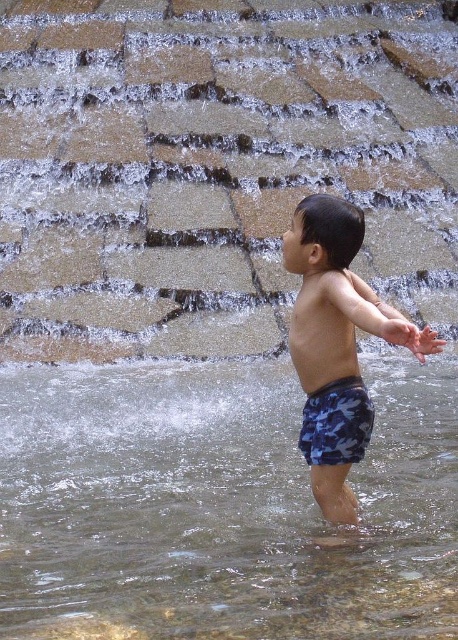
Is clear water at lower center thinner than blue camouflage shorts at center?

No, clear water at lower center is not thinner than blue camouflage shorts at center.

Based on the photo, does clear water at lower center appear under blue camouflage shorts at center?

Yes, clear water at lower center is below blue camouflage shorts at center.

What do you see at coordinates (221, 504) in the screenshot? I see `clear water at lower center` at bounding box center [221, 504].

You are a GUI agent. You are given a task and a screenshot of the screen. Output one action in this format:
    pyautogui.click(x=<x>, y=<y>)
    Task: Click on the clear water at lower center
    The width and height of the screenshot is (458, 640).
    Given the screenshot: What is the action you would take?
    pyautogui.click(x=221, y=504)

In the scene shown: Can you confirm if blue camouflage shorts at center is positioned to the left of camouflage fabric shorts at center?

Incorrect, blue camouflage shorts at center is not on the left side of camouflage fabric shorts at center.

Does blue camouflage shorts at center have a greater height compared to camouflage fabric shorts at center?

Yes, blue camouflage shorts at center is taller than camouflage fabric shorts at center.

I want to click on blue camouflage shorts at center, so click(337, 342).

Is clear water at lower center further to camera compared to camouflage shorts at center?

No.

Is point (306, 538) positioned in front of point (298, 369)?

Yes, it is.

The height and width of the screenshot is (640, 458). Identify the location of clear water at lower center. (221, 504).